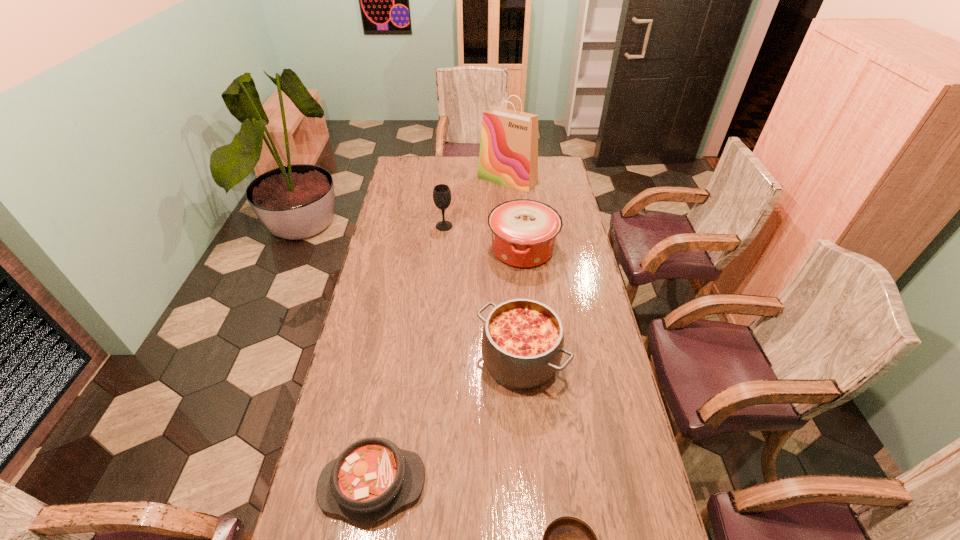
Locate an element on the screen. The height and width of the screenshot is (540, 960). blank area located on the front of the second farthest casserole is located at coordinates (534, 534).

I want to click on vacant area located 0.110m on the back of the second shortest object, so click(x=385, y=411).

Where is `object located in the far edge section of the desktop`? object located in the far edge section of the desktop is located at coordinates (508, 155).

You are a GUI agent. You are given a task and a screenshot of the screen. Output one action in this format:
    pyautogui.click(x=<x>, y=<y>)
    Task: Click on the object that is positioned at the left edge
    The height and width of the screenshot is (540, 960).
    Given the screenshot: What is the action you would take?
    pyautogui.click(x=372, y=478)

The image size is (960, 540). I want to click on shopping bag that is at the right edge, so [508, 155].

Find the location of a particular element. casserole that is at the right edge is located at coordinates (524, 231).

The width and height of the screenshot is (960, 540). What are the coordinates of `object situated at the far right corner` in the screenshot? It's located at (508, 155).

The height and width of the screenshot is (540, 960). Find the location of `vacant space at the far edge of the desktop`. vacant space at the far edge of the desktop is located at coordinates (467, 165).

In the image, there is a desktop. At what (x,y) coordinates should I click in order to perform the action: click on free region at the left edge. Please return your answer as a coordinate pair (x, y). The width and height of the screenshot is (960, 540). Looking at the image, I should click on click(367, 406).

I want to click on vacant space at the right edge of the desktop, so point(590,421).